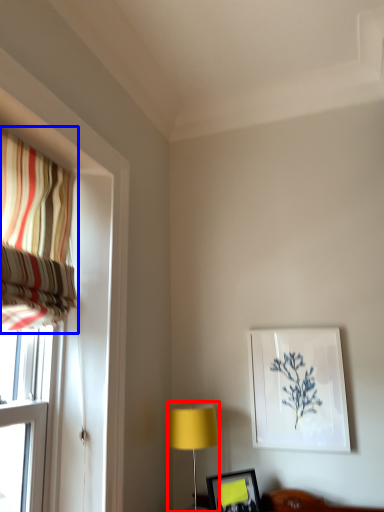
Question: Which point is further to the camera, table lamp (highlighted by a red box) or curtain (highlighted by a blue box)?

Choices:
 (A) table lamp
 (B) curtain

Answer: (A)